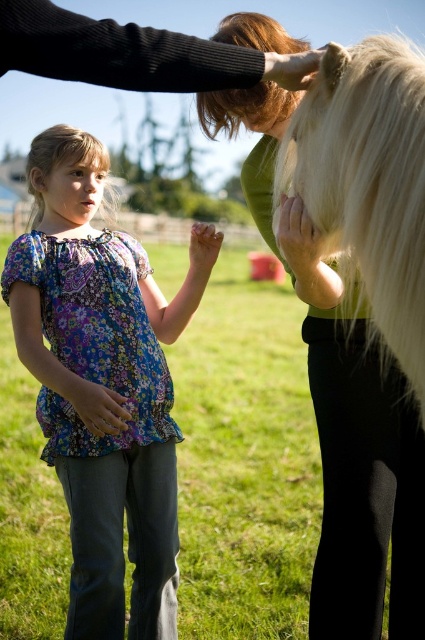
Does point (87, 385) come closer to viewer compared to point (204, 262)?

Yes, it is.

Is matte floral blouse at center to the left of matte skin hand at center from the viewer's perspective?

Yes, matte floral blouse at center is to the left of matte skin hand at center.

Image resolution: width=425 pixels, height=640 pixels. Identify the location of matte floral blouse at center. (96, 404).

How distant is white silky horse at upper right from smooth skin hand at upper center?

They are 11.11 inches apart.

Between white silky horse at upper right and smooth skin hand at upper center, which one is positioned higher?

smooth skin hand at upper center

Is point (382, 147) positioned before point (263, 70)?

Yes, it is.

Where is `white silky horse at upper right`? white silky horse at upper right is located at coordinates (368, 182).

Is floral fabric blouse at center shorter than matte white hand at center?

Incorrect, floral fabric blouse at center's height does not fall short of matte white hand at center's.

Is floral fabric blouse at center closer to camera compared to matte white hand at center?

No, it is not.

Which is in front, point (161, 516) or point (288, 243)?

Point (288, 243)

This screenshot has width=425, height=640. What are the coordinates of `floral fabric blouse at center` in the screenshot? It's located at (102, 385).